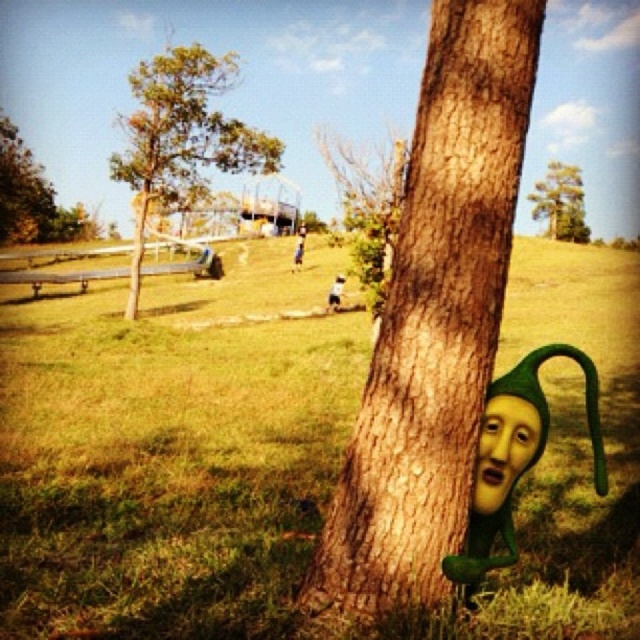
Question: Which of the following is the closest to the observer?

Choices:
 (A) green matte tree at upper center
 (B) brown rough tree trunk at center
 (C) green textured tree at upper left

Answer: (B)

Question: Is brown rough bark tree at center to the right of green matte tree at upper left from the viewer's perspective?

Choices:
 (A) yes
 (B) no

Answer: (A)

Question: Which point appears closest to the camera in this image?

Choices:
 (A) (358, 284)
 (B) (20, 234)

Answer: (A)

Question: Is green textured tree at upper left smaller than green matte tree at upper left?

Choices:
 (A) yes
 (B) no

Answer: (B)

Question: Which of the following is the farthest from the observer?

Choices:
 (A) green matte tree at upper left
 (B) green matte tree at upper center
 (C) green textured tree at upper left
 (D) brown rough bark tree at center

Answer: (B)

Question: Where is green textured tree at upper left located in relation to green matte tree at upper center in the image?

Choices:
 (A) above
 (B) below

Answer: (B)